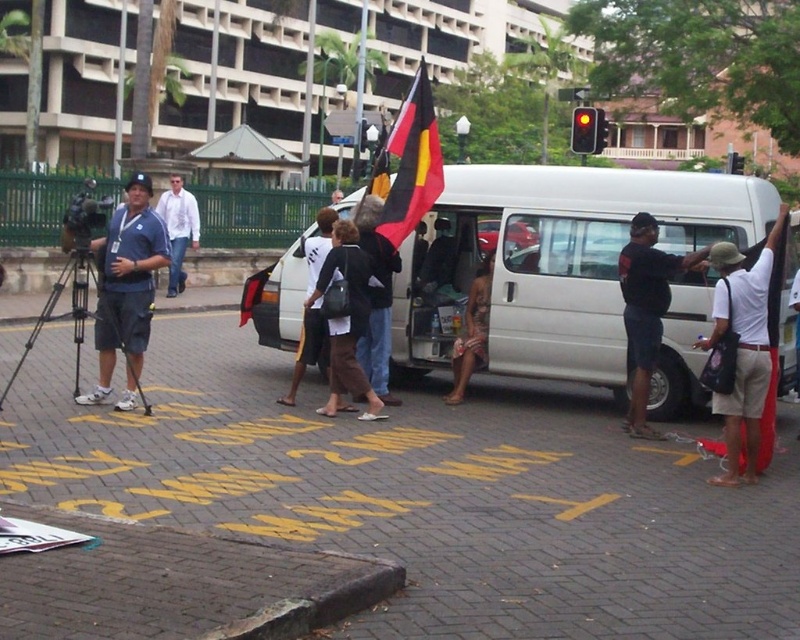
Does blue fabric cap at left have a lesser height compared to matte black tripod at left?

Incorrect, blue fabric cap at left's height does not fall short of matte black tripod at left's.

Is blue fabric cap at left to the left of matte black tripod at left from the viewer's perspective?

In fact, blue fabric cap at left is to the right of matte black tripod at left.

Is point (136, 296) closer to camera compared to point (38, 323)?

Yes, it is in front of point (38, 323).

Where is `blue fabric cap at left`? blue fabric cap at left is located at coordinates (126, 289).

Between blue fabric cap at left and black and yellow fabric flag at center, which one is positioned higher?

Positioned higher is black and yellow fabric flag at center.

Which is behind, point (141, 202) or point (432, 106)?

Point (432, 106)

Between point (138, 292) and point (382, 221), which one is positioned in front?

Positioned in front is point (138, 292).

This screenshot has height=640, width=800. I want to click on blue fabric cap at left, so click(x=126, y=289).

Between white cotton shirt at right and blue fabric cap at left, which one appears on the left side from the viewer's perspective?

blue fabric cap at left

Does point (720, 397) come behind point (120, 320)?

That is False.

This screenshot has height=640, width=800. In order to click on white cotton shirt at right in this screenshot , I will do pos(744,348).